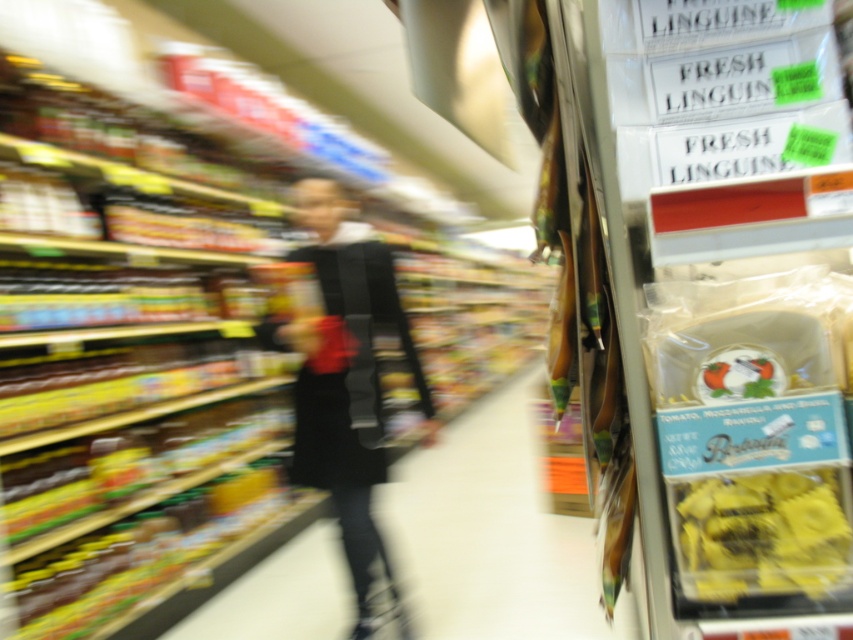
You are a store employee organizing items on a shelf. You have a black fabric at center and a yellow matte pasta at right. Which item should you place on the wider shelf space to ensure proper display?

The black fabric at center should be placed on the wider shelf space because its width is larger than the yellow matte pasta at right.

From the picture: You are a customer in a grocery store and see the black fabric at center and the yellow matte pasta at right. Which object is taller?

The black fabric at center is much taller than the yellow matte pasta at right.

You are a store employee who needs to place a new item on the shelf between the matte black bag at center and the black fabric at center. The item is 1.5 meters long. Can it fit between them?

The distance between the matte black bag at center and the black fabric at center is 1.45 meters. Since the item is 1.5 meters long, it cannot fit between them as the space is slightly shorter than the item.